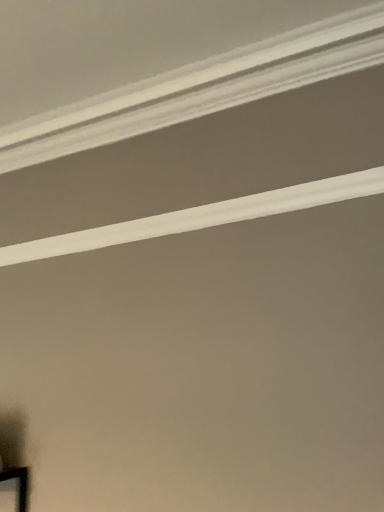
You are a GUI agent. You are given a task and a screenshot of the screen. Output one action in this format:
    pyautogui.click(x=<x>, y=<y>)
    Task: Click on the white smooth crown molding at upper center, which is the 2th strip in top-to-bottom order
    
    Given the screenshot: What is the action you would take?
    pyautogui.click(x=202, y=216)

Describe the element at coordinates (202, 216) in the screenshot. This screenshot has width=384, height=512. I see `white smooth crown molding at upper center, which is the 2th strip in top-to-bottom order` at that location.

This screenshot has height=512, width=384. Describe the element at coordinates (201, 88) in the screenshot. I see `white smooth crown molding at upper center, the second strip positioned from the bottom` at that location.

At what (x,y) coordinates should I click in order to perform the action: click on white smooth crown molding at upper center, which is counted as the first strip, starting from the top. Please return your answer as a coordinate pair (x, y). This screenshot has width=384, height=512. Looking at the image, I should click on (201, 88).

Find the location of a particular element. white smooth crown molding at upper center, arranged as the 1th strip when ordered from the bottom is located at coordinates (202, 216).

Can you confirm if white smooth crown molding at upper center, which is counted as the first strip, starting from the top, is positioned to the right of white smooth crown molding at upper center, which is the 2th strip in top-to-bottom order?

No, white smooth crown molding at upper center, which is counted as the first strip, starting from the top, is not to the right of white smooth crown molding at upper center, which is the 2th strip in top-to-bottom order.

Is white smooth crown molding at upper center, which is counted as the first strip, starting from the top, positioned in front of white smooth crown molding at upper center, which is the 2th strip in top-to-bottom order?

Yes, the depth of white smooth crown molding at upper center, which is counted as the first strip, starting from the top, is less than that of white smooth crown molding at upper center, which is the 2th strip in top-to-bottom order.

Is point (184, 109) closer or farther from the camera than point (244, 214)?

Point (184, 109) is farther from the camera than point (244, 214).

From the image's perspective, is white smooth crown molding at upper center, which is counted as the first strip, starting from the top, positioned above or below white smooth crown molding at upper center, arranged as the 1th strip when ordered from the bottom?

white smooth crown molding at upper center, which is counted as the first strip, starting from the top, is above white smooth crown molding at upper center, arranged as the 1th strip when ordered from the bottom.

From a real-world perspective, is white smooth crown molding at upper center, which is counted as the first strip, starting from the top, physically located above or below white smooth crown molding at upper center, arranged as the 1th strip when ordered from the bottom?

white smooth crown molding at upper center, which is counted as the first strip, starting from the top, is above white smooth crown molding at upper center, arranged as the 1th strip when ordered from the bottom.

Is white smooth crown molding at upper center, the second strip positioned from the bottom, wider or thinner than white smooth crown molding at upper center, arranged as the 1th strip when ordered from the bottom?

white smooth crown molding at upper center, the second strip positioned from the bottom, is wider than white smooth crown molding at upper center, arranged as the 1th strip when ordered from the bottom.

Which of these two, white smooth crown molding at upper center, the second strip positioned from the bottom, or white smooth crown molding at upper center, which is the 2th strip in top-to-bottom order, stands shorter?

white smooth crown molding at upper center, the second strip positioned from the bottom.

Based on their sizes in the image, would you say white smooth crown molding at upper center, which is counted as the first strip, starting from the top, is bigger or smaller than white smooth crown molding at upper center, arranged as the 1th strip when ordered from the bottom?

Considering their sizes, white smooth crown molding at upper center, which is counted as the first strip, starting from the top, takes up more space than white smooth crown molding at upper center, arranged as the 1th strip when ordered from the bottom.

Is white smooth crown molding at upper center, which is counted as the first strip, starting from the top, positioned beyond the bounds of white smooth crown molding at upper center, arranged as the 1th strip when ordered from the bottom?

Yes, white smooth crown molding at upper center, which is counted as the first strip, starting from the top, is not within white smooth crown molding at upper center, arranged as the 1th strip when ordered from the bottom.

Are white smooth crown molding at upper center, the second strip positioned from the bottom, and white smooth crown molding at upper center, which is the 2th strip in top-to-bottom order, beside each other?

There is a gap between white smooth crown molding at upper center, the second strip positioned from the bottom, and white smooth crown molding at upper center, which is the 2th strip in top-to-bottom order.

From the picture: Is white smooth crown molding at upper center, the second strip positioned from the bottom, aimed at white smooth crown molding at upper center, arranged as the 1th strip when ordered from the bottom?

No, white smooth crown molding at upper center, the second strip positioned from the bottom, is not aimed at white smooth crown molding at upper center, arranged as the 1th strip when ordered from the bottom.

How different are the orientations of white smooth crown molding at upper center, which is counted as the first strip, starting from the top, and white smooth crown molding at upper center, arranged as the 1th strip when ordered from the bottom, in degrees?

They differ by 89.9 degrees in their facing directions.

In order to click on strip on the left of white smooth crown molding at upper center, arranged as the 1th strip when ordered from the bottom in this screenshot , I will do 201,88.

Between white smooth crown molding at upper center, which is the 2th strip in top-to-bottom order, and white smooth crown molding at upper center, the second strip positioned from the bottom, which one appears on the right side from the viewer's perspective?

white smooth crown molding at upper center, which is the 2th strip in top-to-bottom order.

Is white smooth crown molding at upper center, arranged as the 1th strip when ordered from the bottom, behind white smooth crown molding at upper center, which is counted as the first strip, starting from the top?

That is True.

Considering the positions of points (113, 234) and (112, 133), is point (113, 234) farther from camera compared to point (112, 133)?

No, it is not.

From the image's perspective, which one is positioned higher, white smooth crown molding at upper center, arranged as the 1th strip when ordered from the bottom, or white smooth crown molding at upper center, which is counted as the first strip, starting from the top?

white smooth crown molding at upper center, which is counted as the first strip, starting from the top.

From a real-world perspective, is white smooth crown molding at upper center, arranged as the 1th strip when ordered from the bottom, below white smooth crown molding at upper center, the second strip positioned from the bottom?

Yes, from a real-world perspective, white smooth crown molding at upper center, arranged as the 1th strip when ordered from the bottom, is below white smooth crown molding at upper center, the second strip positioned from the bottom.

Considering the sizes of white smooth crown molding at upper center, arranged as the 1th strip when ordered from the bottom, and white smooth crown molding at upper center, the second strip positioned from the bottom, in the image, is white smooth crown molding at upper center, arranged as the 1th strip when ordered from the bottom, wider or thinner than white smooth crown molding at upper center, the second strip positioned from the bottom,?

In the image, white smooth crown molding at upper center, arranged as the 1th strip when ordered from the bottom, appears to be more narrow than white smooth crown molding at upper center, the second strip positioned from the bottom.

Is white smooth crown molding at upper center, which is the 2th strip in top-to-bottom order, taller than white smooth crown molding at upper center, which is counted as the first strip, starting from the top?

Indeed, white smooth crown molding at upper center, which is the 2th strip in top-to-bottom order, has a greater height compared to white smooth crown molding at upper center, which is counted as the first strip, starting from the top.

Between white smooth crown molding at upper center, which is the 2th strip in top-to-bottom order, and white smooth crown molding at upper center, which is counted as the first strip, starting from the top, which one has larger size?

Bigger between the two is white smooth crown molding at upper center, which is counted as the first strip, starting from the top.

Is white smooth crown molding at upper center, which is the 2th strip in top-to-bottom order, inside or outside of white smooth crown molding at upper center, which is counted as the first strip, starting from the top?

white smooth crown molding at upper center, which is the 2th strip in top-to-bottom order, exists outside the volume of white smooth crown molding at upper center, which is counted as the first strip, starting from the top.

Are white smooth crown molding at upper center, which is the 2th strip in top-to-bottom order, and white smooth crown molding at upper center, which is counted as the first strip, starting from the top, far apart?

Actually, white smooth crown molding at upper center, which is the 2th strip in top-to-bottom order, and white smooth crown molding at upper center, which is counted as the first strip, starting from the top, are a little close together.

Is white smooth crown molding at upper center, arranged as the 1th strip when ordered from the bottom, oriented towards white smooth crown molding at upper center, the second strip positioned from the bottom?

No, white smooth crown molding at upper center, arranged as the 1th strip when ordered from the bottom, is not turned towards white smooth crown molding at upper center, the second strip positioned from the bottom.

Can you tell me how much white smooth crown molding at upper center, which is the 2th strip in top-to-bottom order, and white smooth crown molding at upper center, which is counted as the first strip, starting from the top, differ in facing direction?

There is a 89.9-degree angle between the facing directions of white smooth crown molding at upper center, which is the 2th strip in top-to-bottom order, and white smooth crown molding at upper center, which is counted as the first strip, starting from the top.

Identify the location of strip located above the white smooth crown molding at upper center, arranged as the 1th strip when ordered from the bottom (from a real-world perspective). (201, 88).

Identify the location of strip positioned vertically above the white smooth crown molding at upper center, arranged as the 1th strip when ordered from the bottom (from a real-world perspective). The image size is (384, 512). (201, 88).

You are a GUI agent. You are given a task and a screenshot of the screen. Output one action in this format:
    pyautogui.click(x=<x>, y=<y>)
    Task: Click on the strip behind the white smooth crown molding at upper center, the second strip positioned from the bottom
    The height and width of the screenshot is (512, 384).
    Given the screenshot: What is the action you would take?
    pyautogui.click(x=202, y=216)